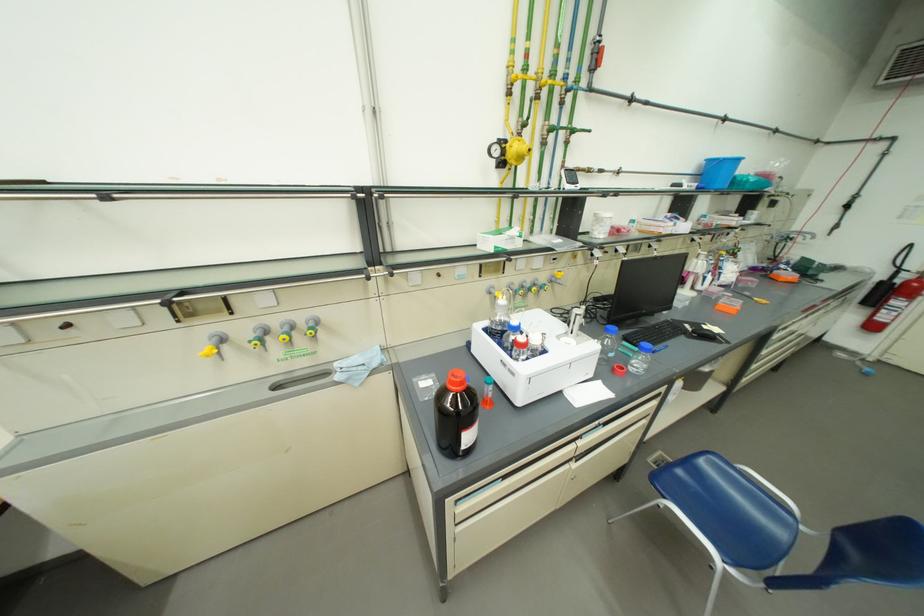
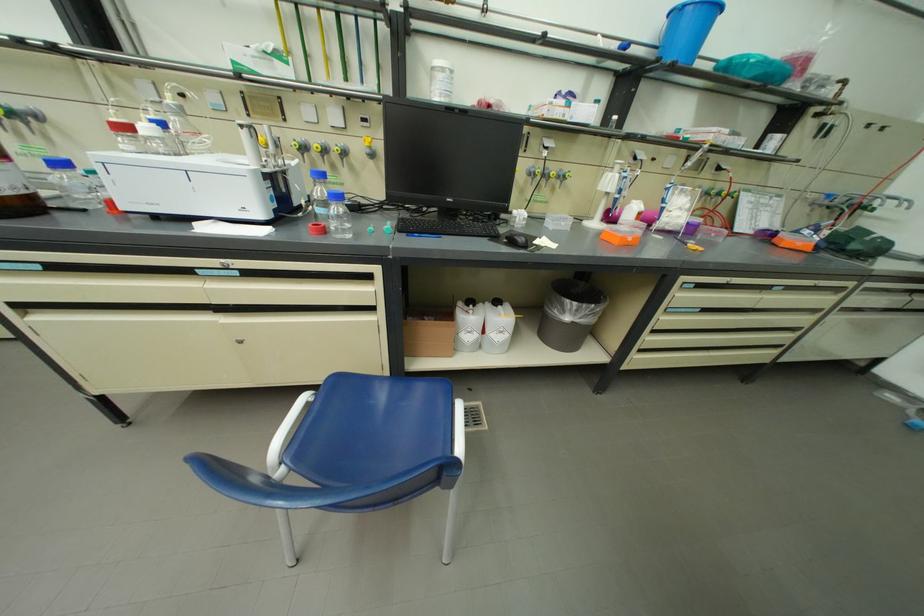
Locate, in the second image, the point that corresponds to pixel 744 314 in the first image.

(626, 244)